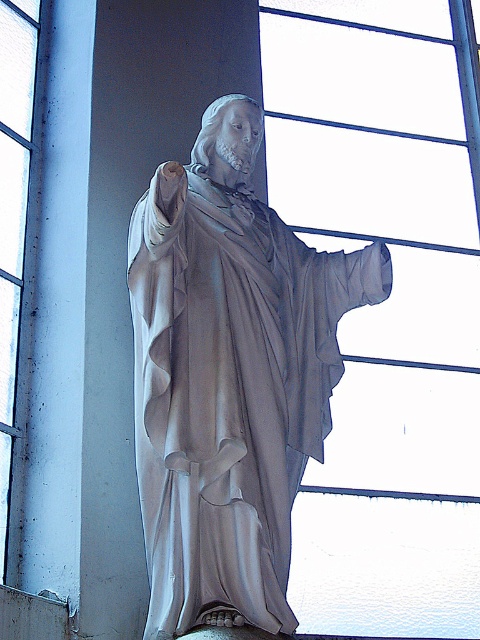
Does white marble statue at center have a larger size compared to transparent glass window at upper left?

Yes, white marble statue at center is bigger than transparent glass window at upper left.

How distant is white marble statue at center from transparent glass window at upper left?

12.66 meters

Locate an element on the screen. The width and height of the screenshot is (480, 640). white marble statue at center is located at coordinates (228, 378).

This screenshot has height=640, width=480. What are the coordinates of `white marble statue at center` in the screenshot? It's located at (228, 378).

Is transparent glass window at upper center to the right of white marble statue at center from the viewer's perspective?

Yes, transparent glass window at upper center is to the right of white marble statue at center.

Is transparent glass window at upper center below white marble statue at center?

No.

Who is more distant from viewer, (x=476, y=216) or (x=155, y=390)?

Point (x=476, y=216)

Identify the location of transparent glass window at upper center. This screenshot has height=640, width=480. (384, 305).

Does transparent glass window at upper center have a greater height compared to transparent glass window at upper left?

Yes, transparent glass window at upper center is taller than transparent glass window at upper left.

Image resolution: width=480 pixels, height=640 pixels. Identify the location of transparent glass window at upper center. (384, 305).

The image size is (480, 640). I want to click on transparent glass window at upper center, so (x=384, y=305).